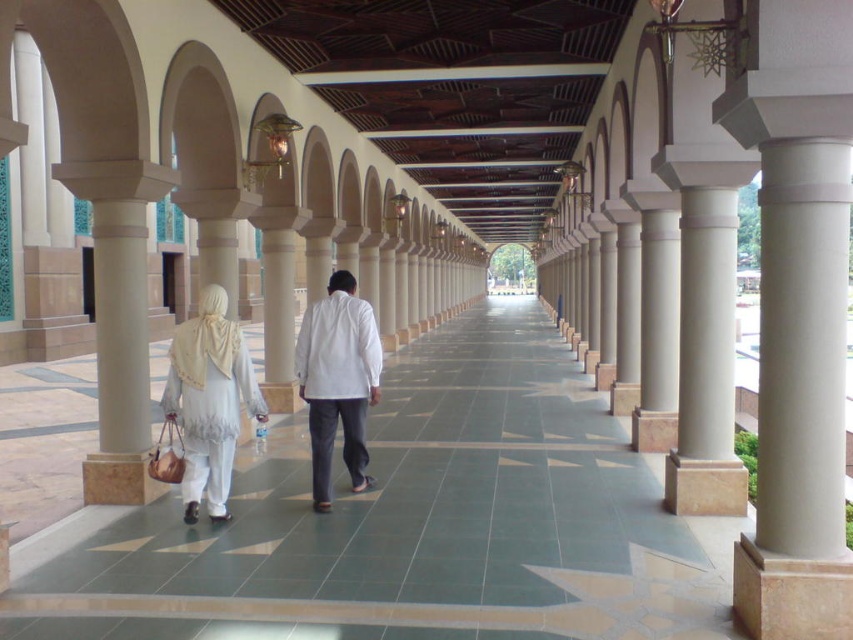
Question: Is the position of smooth stone corridor at center more distant than that of white matte/soft fabric dress at left?

Choices:
 (A) no
 (B) yes

Answer: (A)

Question: Is smooth stone corridor at center below white matte shirt at center?

Choices:
 (A) yes
 (B) no

Answer: (A)

Question: Among these objects, which one is farthest from the camera?

Choices:
 (A) white matte shirt at center
 (B) light beige fabric dress at center
 (C) white matte/soft fabric dress at left

Answer: (B)

Question: Among these objects, which one is nearest to the camera?

Choices:
 (A) light beige fabric dress at center
 (B) white matte shirt at center

Answer: (B)

Question: Can you confirm if light beige fabric dress at center is thinner than white matte/soft fabric dress at left?

Choices:
 (A) no
 (B) yes

Answer: (B)

Question: Which point appears farthest from the camera in this image?

Choices:
 (A) (320, 353)
 (B) (222, 442)
 (C) (344, 426)

Answer: (C)